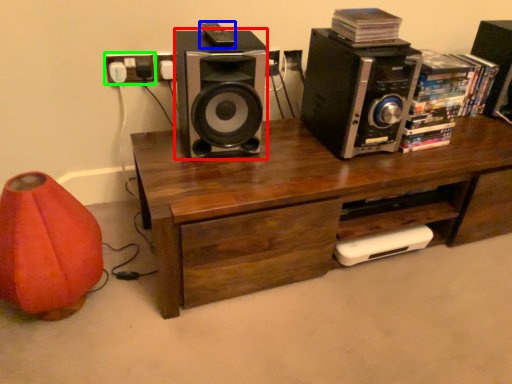
Question: Which object is positioned closest to speaker (highlighted by a red box)? Select from ipod (highlighted by a blue box) and electric outlet (highlighted by a green box).

Choices:
 (A) ipod
 (B) electric outlet

Answer: (A)